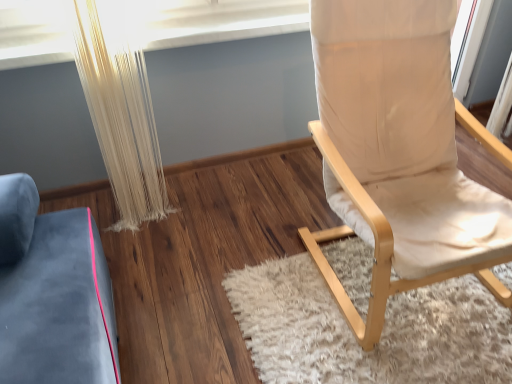
Question: Is beige fabric chair at right in front of or behind white textured curtain at left in the image?

Choices:
 (A) front
 (B) behind

Answer: (A)

Question: From the image's perspective, is beige fabric chair at right positioned above or below white textured curtain at left?

Choices:
 (A) above
 (B) below

Answer: (B)

Question: Considering the real-world distances, which object is closest to the white textured curtain at left?

Choices:
 (A) white shaggy rug at center
 (B) beige fabric chair at right

Answer: (A)

Question: Which is nearer to the white shaggy rug at center?

Choices:
 (A) beige fabric chair at right
 (B) white textured curtain at left

Answer: (A)